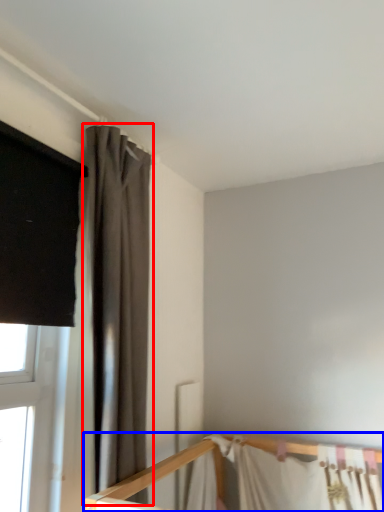
Question: Among these objects, which one is nearest to the camera, curtain (highlighted by a red box) or bed (highlighted by a blue box)?

Choices:
 (A) curtain
 (B) bed

Answer: (A)